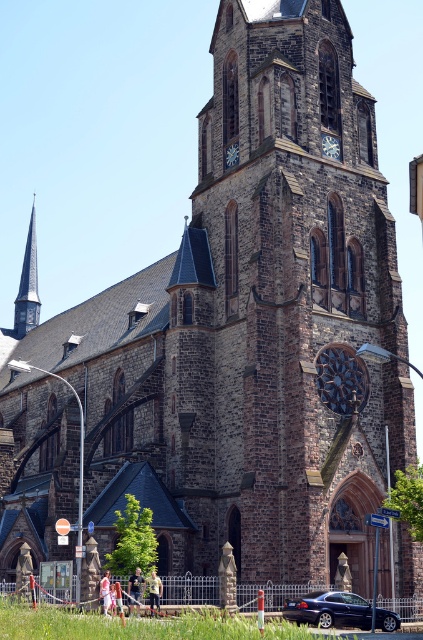
Question: Does light brown leather jacket at center appear over blue painted metal clock at upper center?

Choices:
 (A) yes
 (B) no

Answer: (B)

Question: Can you confirm if blue painted metal clock at upper center is positioned to the right of light pink fabric at lower center?

Choices:
 (A) yes
 (B) no

Answer: (A)

Question: Does blue painted metal clock at upper center appear on the right side of light pink fabric at lower center?

Choices:
 (A) yes
 (B) no

Answer: (A)

Question: Which object is positioned closest to the metallic blue sedan at lower right?

Choices:
 (A) light pink fabric at center
 (B) blue glass spire at left
 (C) light pink fabric at lower center
 (D) white stone clock at upper center

Answer: (C)

Question: Estimate the real-world distances between objects in this image. Which object is closer to the metallic blue sedan at lower right?

Choices:
 (A) light brown leather jacket at lower center
 (B) light brown leather jacket at center

Answer: (A)

Question: Based on their relative distances, which object is nearer to the light pink fabric at lower center?

Choices:
 (A) blue glass spire at left
 (B) white stone clock at upper center
 (C) metallic blue sedan at lower right
 (D) blue painted metal clock at upper center

Answer: (C)